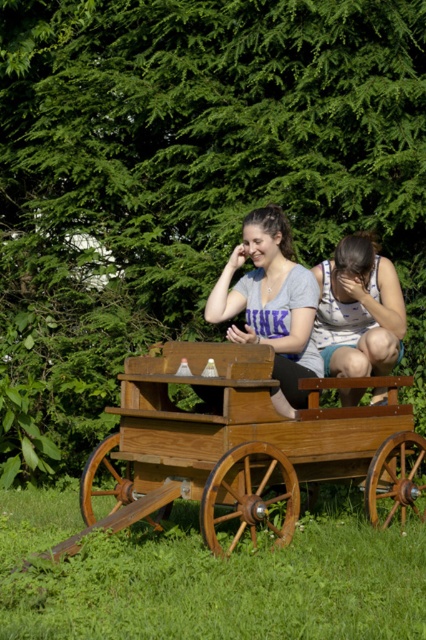
Question: Among these objects, which one is farthest from the camera?

Choices:
 (A) matte gray shirt at center
 (B) striped cotton shirt at center
 (C) wooden wagon at center

Answer: (B)

Question: Which object is closer to the camera taking this photo?

Choices:
 (A) striped cotton shirt at center
 (B) matte gray shirt at center
 (C) green grass at lower center

Answer: (C)

Question: Does green grass at lower center appear on the left side of striped cotton shirt at center?

Choices:
 (A) yes
 (B) no

Answer: (A)

Question: Can you confirm if green grass at lower center is positioned to the left of striped cotton shirt at center?

Choices:
 (A) no
 (B) yes

Answer: (B)

Question: Does green grass at lower center appear over wooden wagon at center?

Choices:
 (A) yes
 (B) no

Answer: (B)

Question: Which object is closer to the camera taking this photo?

Choices:
 (A) striped cotton shirt at center
 (B) green grass at lower center
 (C) matte gray shirt at center
 (D) wooden wagon at center

Answer: (B)